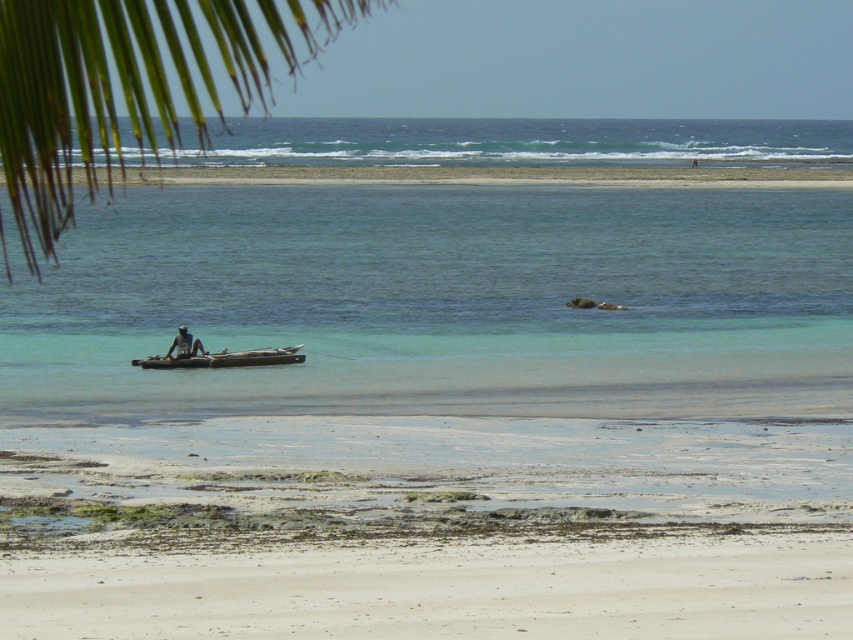
Question: Which object appears closest to the camera in this image?

Choices:
 (A) wooden raft at center
 (B) white sandy beach at lower center
 (C) light brown wooden canoe at center
 (D) green leafy palm tree at upper left

Answer: (D)

Question: Can you confirm if green leafy palm tree at upper left is thinner than wooden raft at center?

Choices:
 (A) yes
 (B) no

Answer: (B)

Question: Which object is closer to the camera taking this photo?

Choices:
 (A) green leafy palm tree at upper left
 (B) wooden raft at center
 (C) light brown wooden canoe at center
 (D) white sandy beach at lower center

Answer: (A)

Question: Observing the image, what is the correct spatial positioning of green leafy palm tree at upper left in reference to wooden raft at center?

Choices:
 (A) right
 (B) left

Answer: (B)

Question: Based on their relative distances, which object is nearer to the white sandy beach at lower center?

Choices:
 (A) green leafy palm tree at upper left
 (B) wooden raft at center

Answer: (B)

Question: Observing the image, what is the correct spatial positioning of green leafy palm tree at upper left in reference to wooden raft at center?

Choices:
 (A) below
 (B) above

Answer: (B)